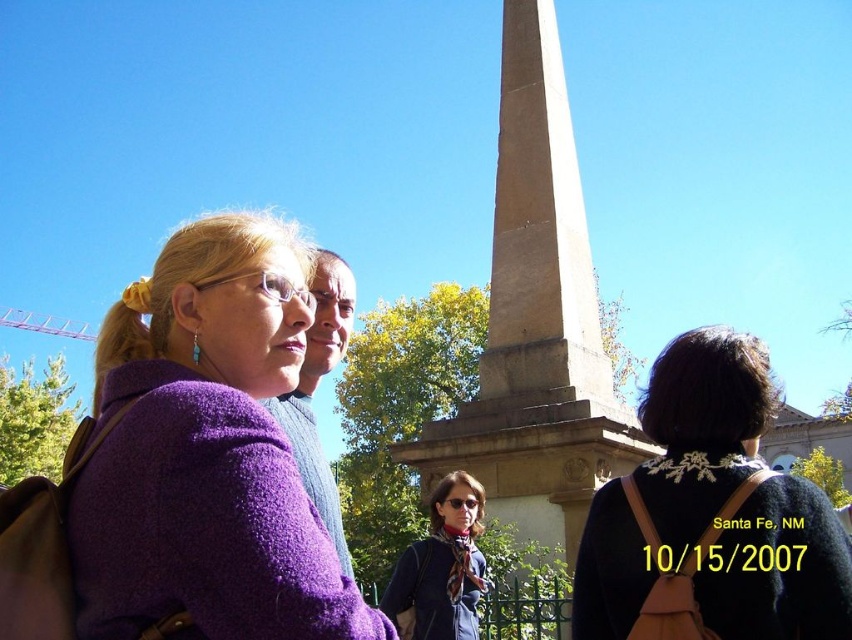
From the picture: Is purple fuzzy coat at left above black lace sweater at upper right?

Yes.

Does purple fuzzy coat at left have a greater width compared to black lace sweater at upper right?

Yes.

Where is `purple fuzzy coat at left`? purple fuzzy coat at left is located at coordinates (206, 452).

The image size is (852, 640). What are the coordinates of `purple fuzzy coat at left` in the screenshot? It's located at (206, 452).

Can you confirm if purple fuzzy coat at left is thinner than brown stone obelisk at center?

Correct, purple fuzzy coat at left's width is less than brown stone obelisk at center's.

Locate an element on the screen. purple fuzzy coat at left is located at coordinates (206, 452).

Where is `purple fuzzy coat at left`? This screenshot has height=640, width=852. purple fuzzy coat at left is located at coordinates (206, 452).

Is black lace sweater at upper right above brown stone obelisk at center?

No.

Does black lace sweater at upper right have a smaller size compared to brown stone obelisk at center?

Indeed, black lace sweater at upper right has a smaller size compared to brown stone obelisk at center.

I want to click on black lace sweater at upper right, so click(x=711, y=516).